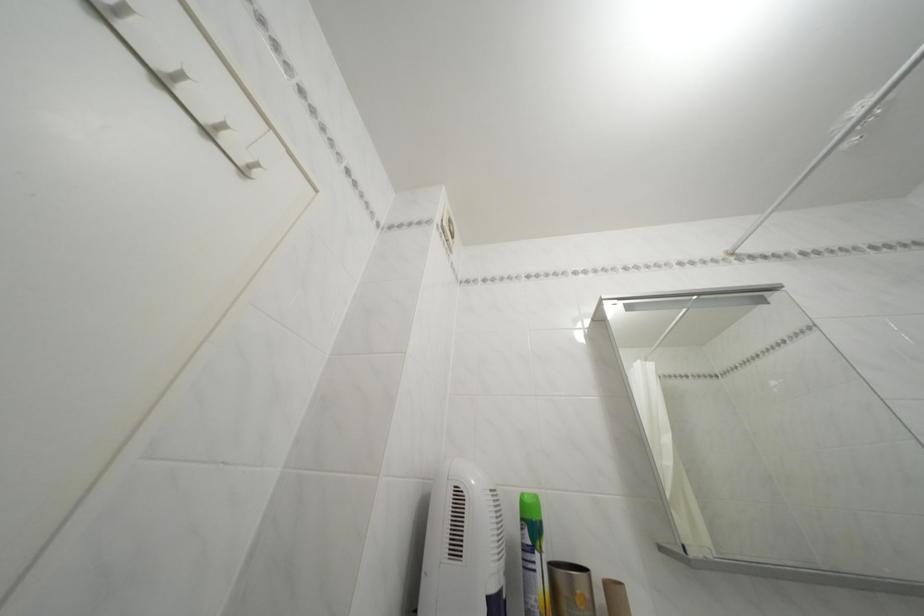
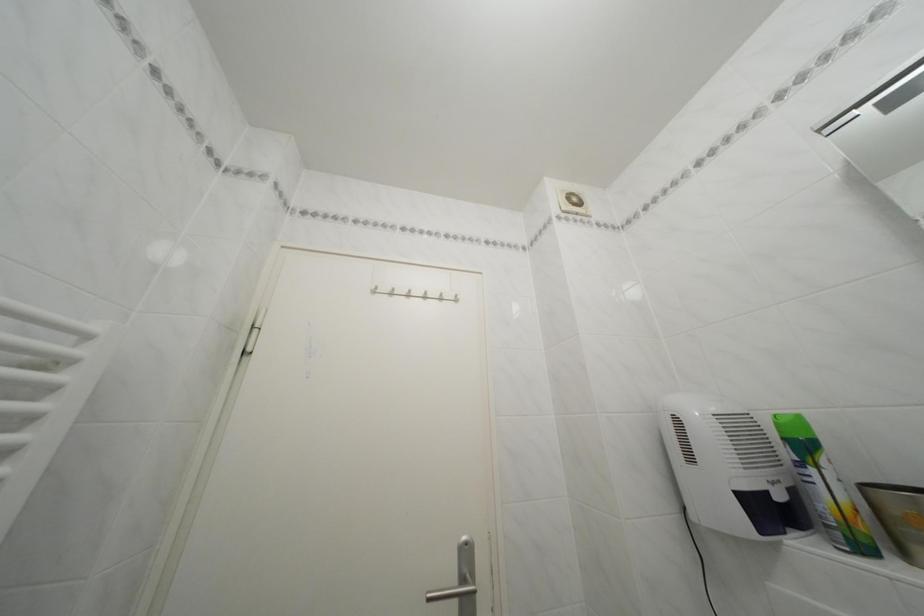
In the second image, find the point that corresponds to the point at 531,525 in the first image.

(793, 445)